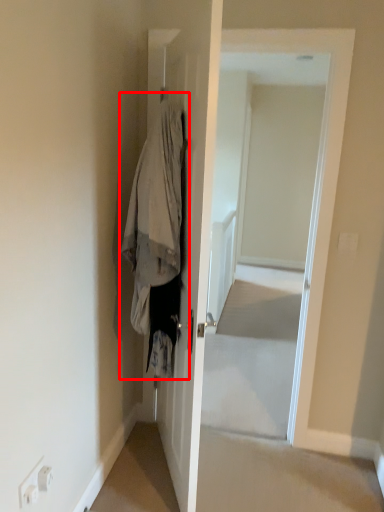
Question: From the image's perspective, considering the relative positions of clothing (annotated by the red box) and screen door in the image provided, where is clothing (annotated by the red box) located with respect to the staircase?

Choices:
 (A) above
 (B) below

Answer: (B)